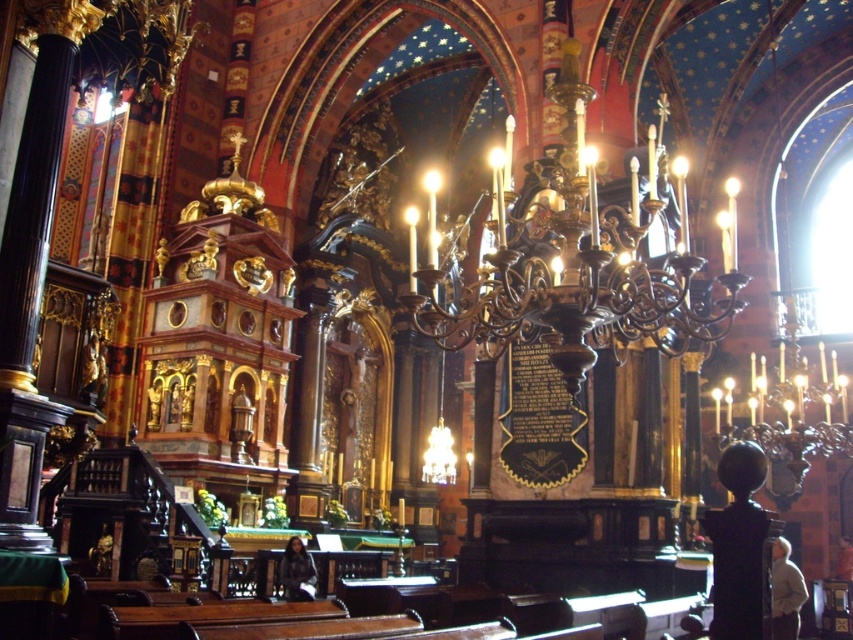
Is light beige sweater at lower right to the right of dark gray fabric jacket at lower center from the viewer's perspective?

Correct, you'll find light beige sweater at lower right to the right of dark gray fabric jacket at lower center.

The image size is (853, 640). Describe the element at coordinates (785, 592) in the screenshot. I see `light beige sweater at lower right` at that location.

Find the location of a particular element. This screenshot has width=853, height=640. light beige sweater at lower right is located at coordinates (785, 592).